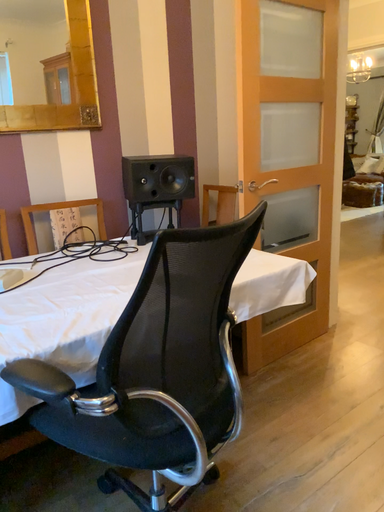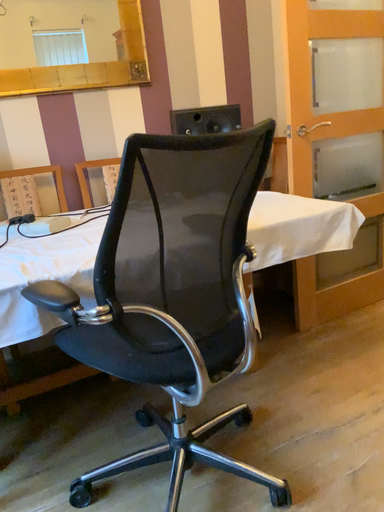
Question: Which way did the camera rotate in the video?

Choices:
 (A) rotated right
 (B) rotated left

Answer: (B)